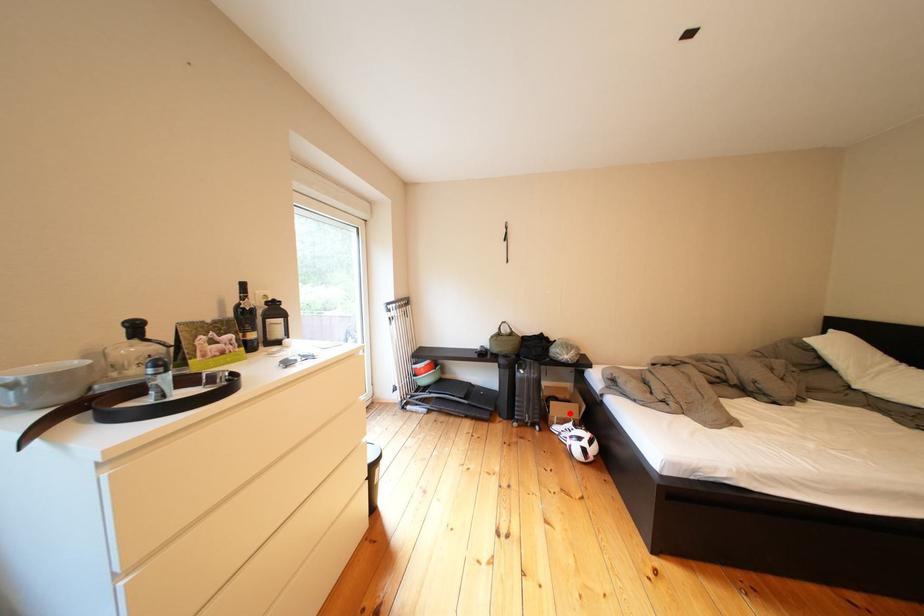
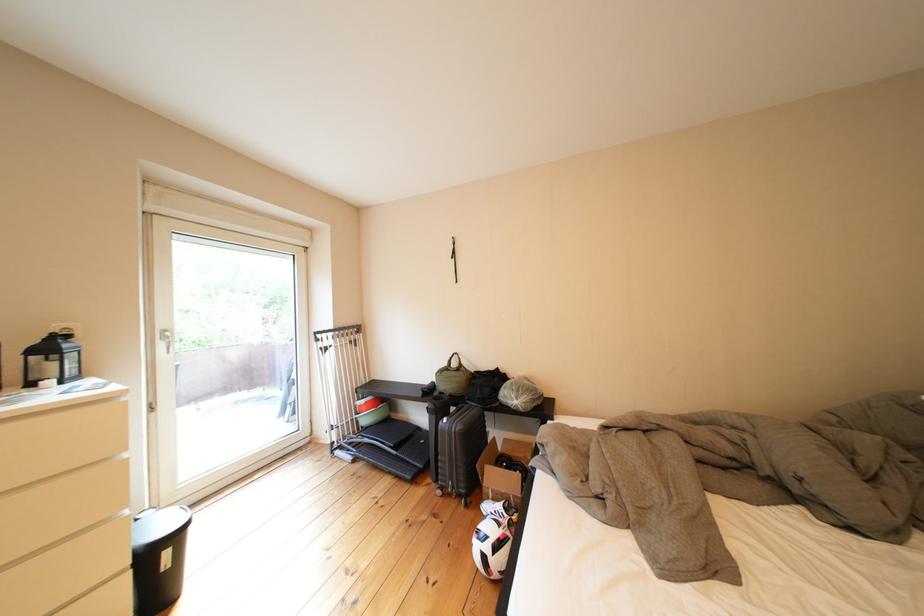
Locate, in the second image, the point that corresponds to the highlighted location in the first image.

(505, 480)